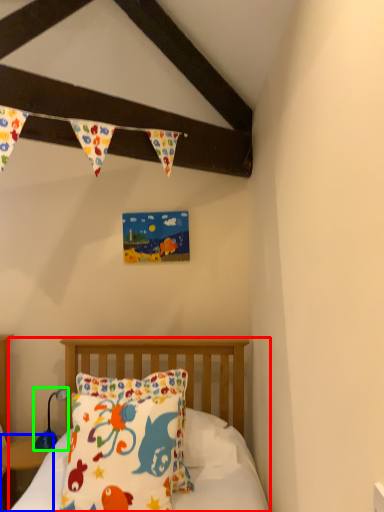
Question: Considering the real-world distances, which object is farthest from bed (highlighted by a red box)? nightstand (highlighted by a blue box) or lamp (highlighted by a green box)?

Choices:
 (A) nightstand
 (B) lamp

Answer: (A)